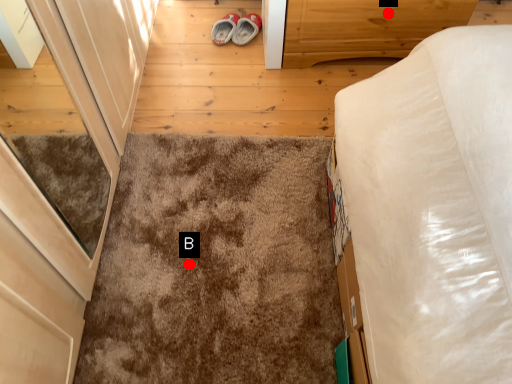
Question: Two points are circled on the image, labeled by A and B beside each circle. Which point is closer to the camera?

Choices:
 (A) A is closer
 (B) B is closer

Answer: (B)